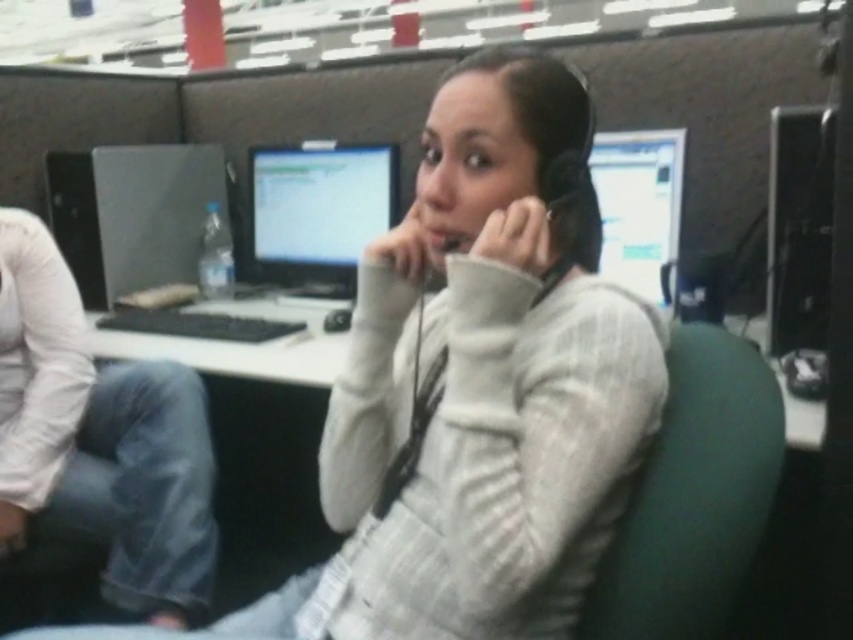
Question: Estimate the real-world distances between objects in this image. Which object is closer to the white textured sweater at center?

Choices:
 (A) green fabric swivel chair at center
 (B) black plastic desktop computer at right
 (C) white plastic computer desk at center

Answer: (A)

Question: Can you confirm if green fabric swivel chair at center is smaller than matte black monitor at center?

Choices:
 (A) no
 (B) yes

Answer: (B)

Question: Which is nearer to the matte black monitor at center?

Choices:
 (A) white plastic computer desk at center
 (B) white textured sweater at center
 (C) green fabric swivel chair at center
 (D) white cotton sweater at center

Answer: (A)

Question: Which of these objects is positioned closest to the black plastic desktop computer at right?

Choices:
 (A) matte black monitor at upper right
 (B) green fabric swivel chair at center

Answer: (A)

Question: Is matte black monitor at center above matte black monitor at upper right?

Choices:
 (A) no
 (B) yes

Answer: (B)

Question: Is green fabric swivel chair at center closer to the viewer compared to matte black monitor at upper right?

Choices:
 (A) no
 (B) yes

Answer: (B)